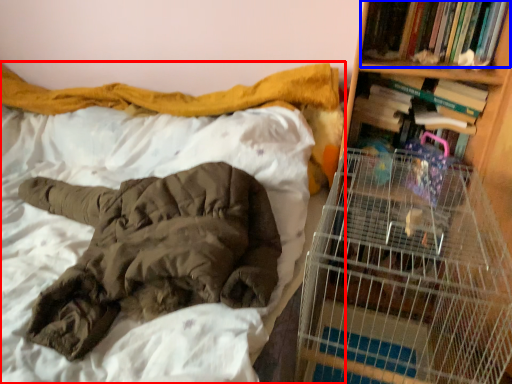
Question: Which point is further to the camera, bed (highlighted by a red box) or book (highlighted by a blue box)?

Choices:
 (A) bed
 (B) book

Answer: (B)